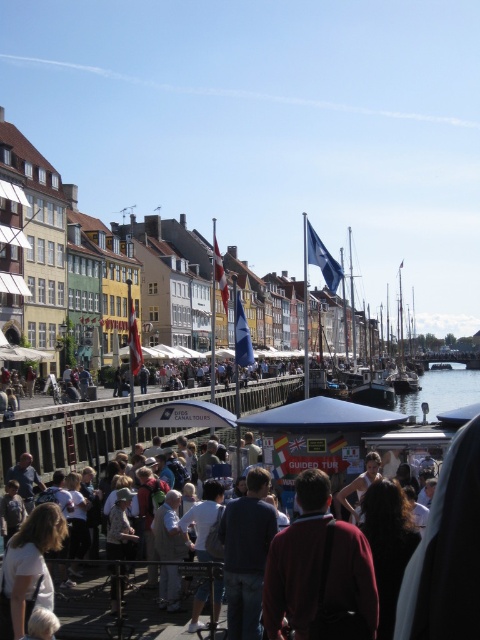
Question: Can you confirm if light gray fabric jacket at center is bigger than matte black dress at center?

Choices:
 (A) no
 (B) yes

Answer: (B)

Question: Which object is positioned farthest from the dark brown hair at center?

Choices:
 (A) white cotton shirt at center
 (B) maroon sweater at center

Answer: (A)

Question: Which object is closer to the camera taking this photo?

Choices:
 (A) light brown hair at lower left
 (B) white cotton shirt at center
 (C) dark blue shirt at center
 (D) dark brown hair at center

Answer: (D)

Question: Does maroon sweater at center have a larger size compared to matte black dress at center?

Choices:
 (A) yes
 (B) no

Answer: (A)

Question: Which point is closer to the camera?

Choices:
 (A) [266, 627]
 (B) [367, 488]

Answer: (A)

Question: Is maroon sweater at center below matte black dress at center?

Choices:
 (A) no
 (B) yes

Answer: (A)